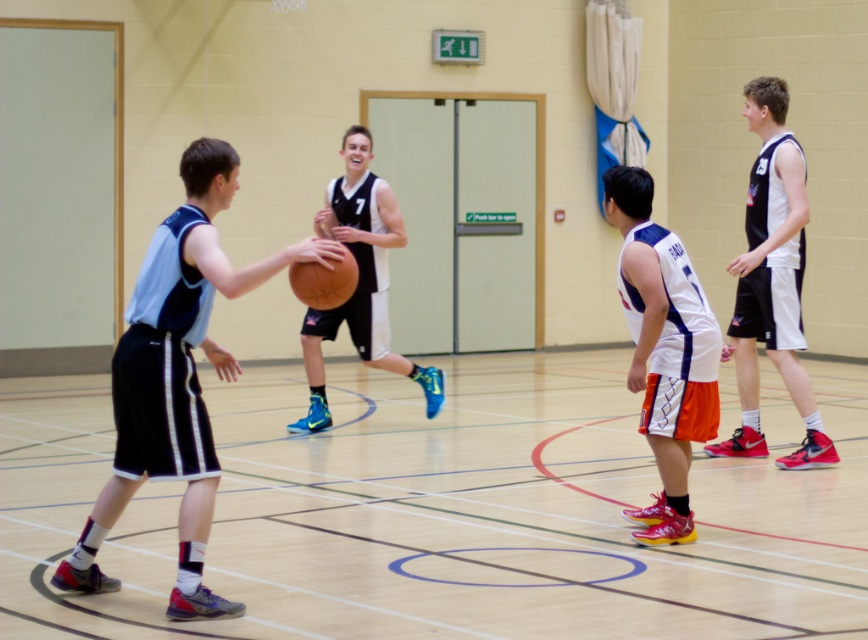
Question: Which object is farther from the camera taking this photo?

Choices:
 (A) white jersey at right
 (B) matte black basketball at center
 (C) rubber textured basketball at center
 (D) matte blue jersey at center

Answer: (B)

Question: Is matte blue jersey at center to the left of matte black basketball at center from the viewer's perspective?

Choices:
 (A) no
 (B) yes

Answer: (B)

Question: Can you confirm if white matte jersey at center is positioned above matte black basketball at center?

Choices:
 (A) no
 (B) yes

Answer: (A)

Question: Which of the following is the farthest from the observer?

Choices:
 (A) (788, 307)
 (B) (327, 285)
 (C) (327, 204)
 (D) (652, 516)

Answer: (C)

Question: Is white matte jersey at center to the right of matte black basketball at center from the viewer's perspective?

Choices:
 (A) yes
 (B) no

Answer: (A)

Question: Among these objects, which one is farthest from the camera?

Choices:
 (A) rubber textured basketball at center
 (B) matte blue jersey at center

Answer: (A)